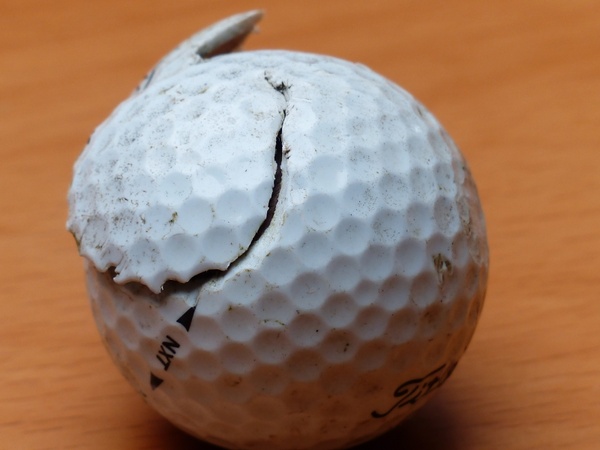
Locate an element on the screen. table is located at coordinates (522, 140).